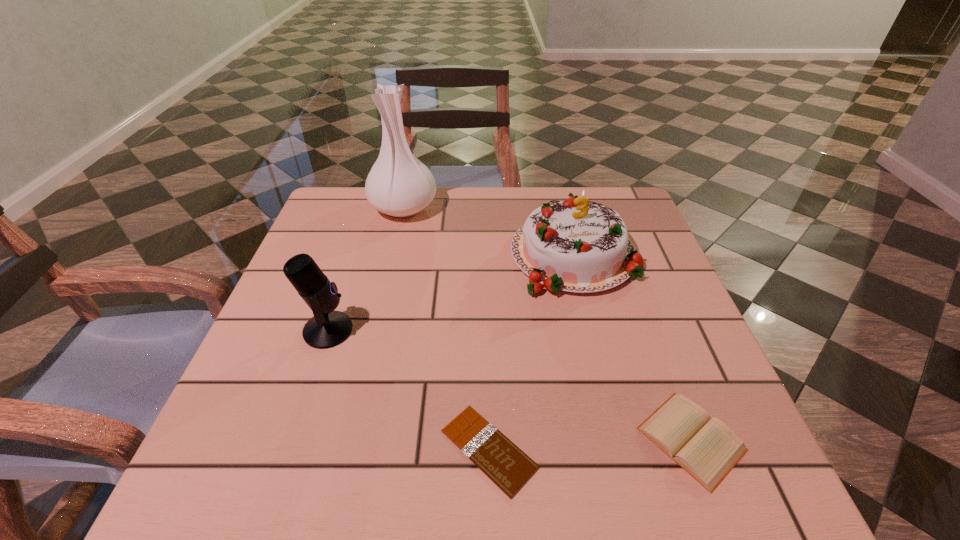
At what (x,y) coordinates should I click in order to perform the action: click on free space that satisfies the following two spatial constraints: 1. on the stand of the chocolate bar; 2. on the right side of the microphone. Please return your answer as a coordinate pair (x, y). This screenshot has height=540, width=960. Looking at the image, I should click on (288, 449).

You are a GUI agent. You are given a task and a screenshot of the screen. Output one action in this format:
    pyautogui.click(x=<x>, y=<y>)
    Task: Click on the free region that satisfies the following two spatial constraints: 1. on the stand of the diary; 2. on the right side of the third farthest object
    This screenshot has width=960, height=540.
    Given the screenshot: What is the action you would take?
    pyautogui.click(x=292, y=439)

Where is `vacant point that satisfies the following two spatial constraints: 1. on the stand of the third farthest object; 2. on the back side of the fourth tallest object`? This screenshot has height=540, width=960. vacant point that satisfies the following two spatial constraints: 1. on the stand of the third farthest object; 2. on the back side of the fourth tallest object is located at coordinates (292, 439).